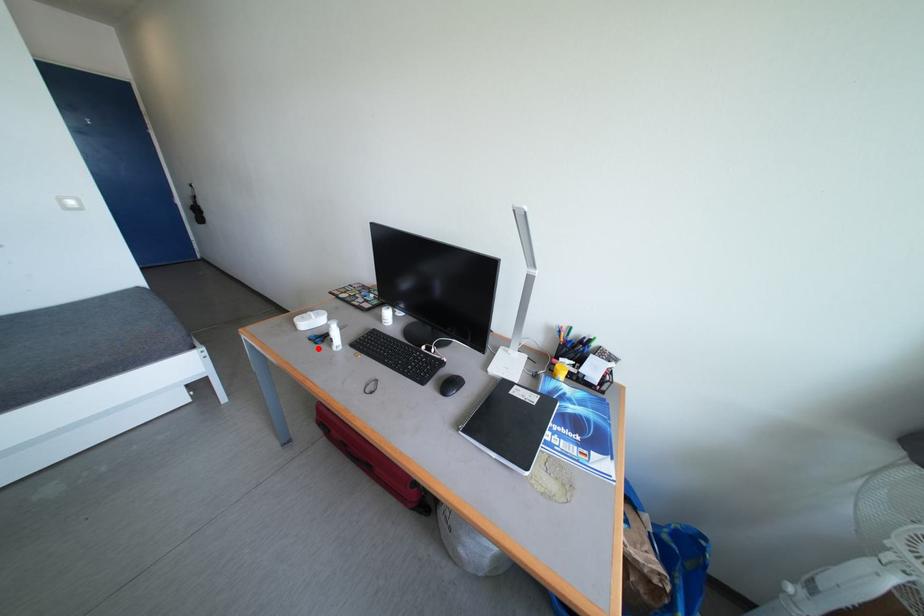
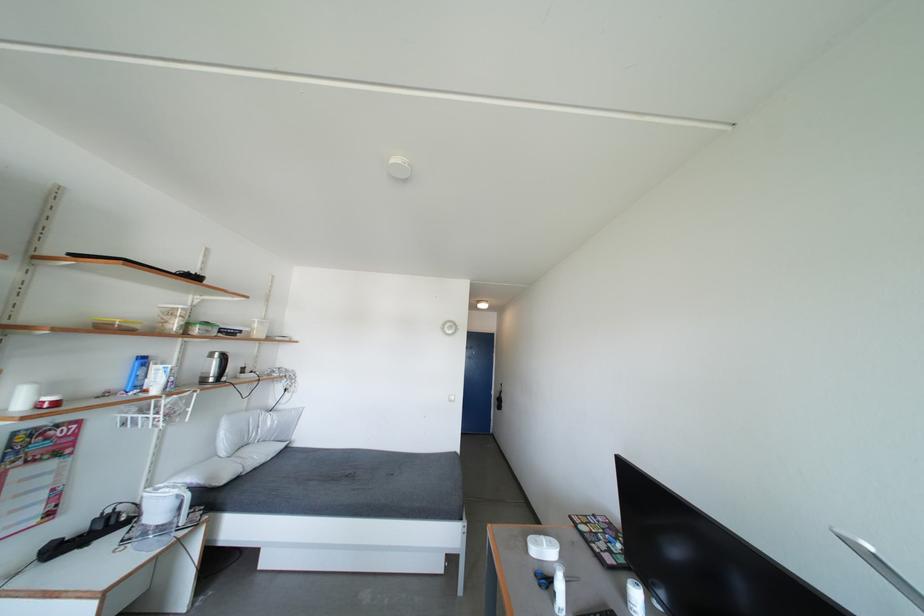
The point at the highlighted location is marked in the first image. Where is the corresponding point in the second image?

(541, 588)